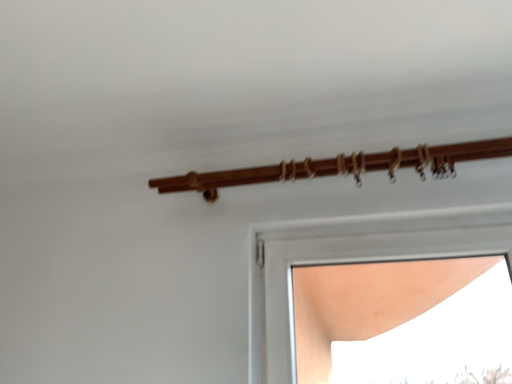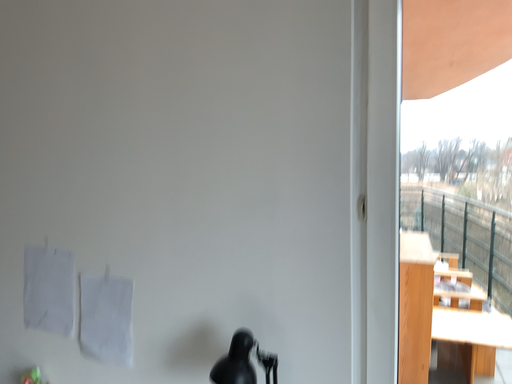
Question: How did the camera likely rotate when shooting the video?

Choices:
 (A) rotated downward
 (B) rotated upward

Answer: (A)